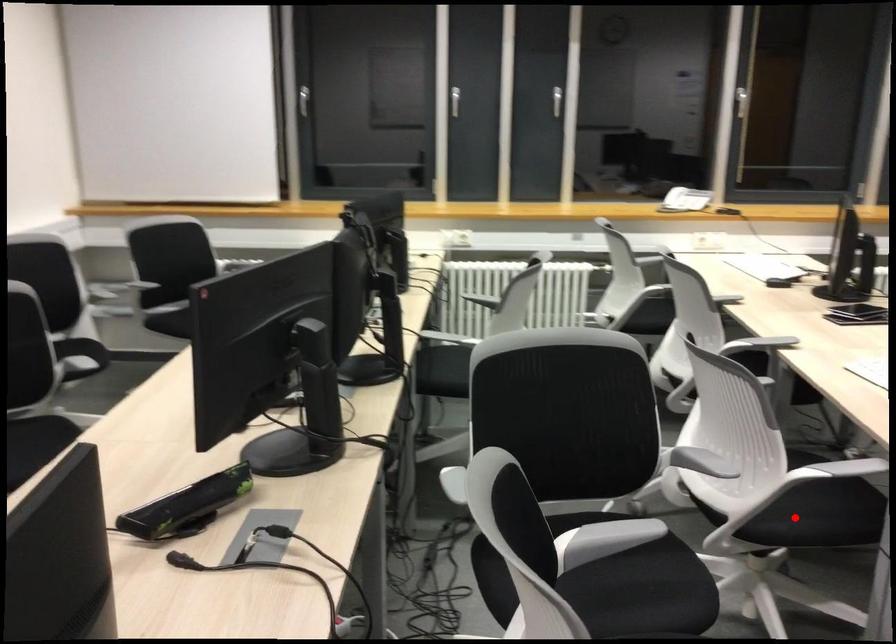
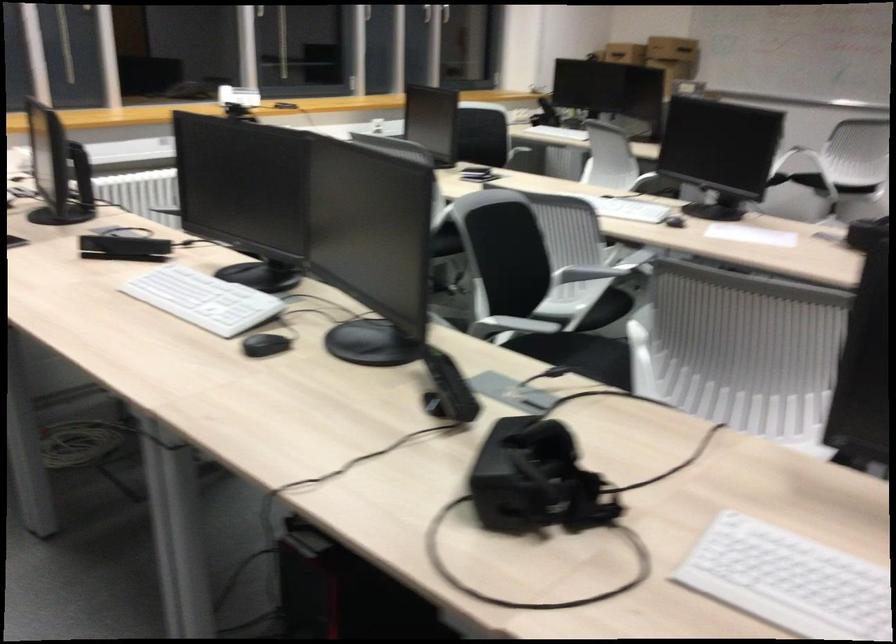
Find the pixel in the second image that matches the highlighted location in the first image.

(607, 308)